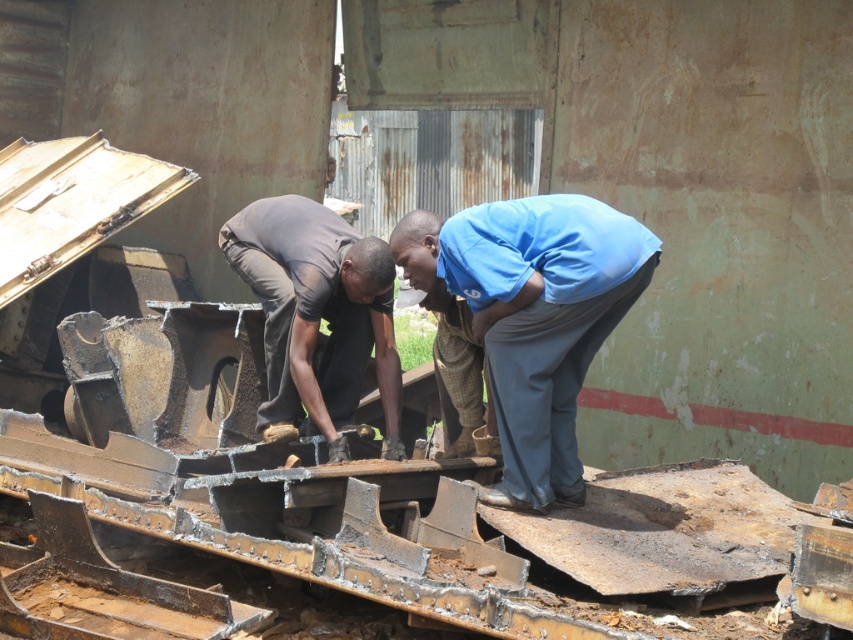
Question: Which object appears farthest from the camera in this image?

Choices:
 (A) dark brown fabric shirt at center
 (B) blue fabric shirt at center

Answer: (A)

Question: Is blue fabric shirt at center below dark brown fabric shirt at center?

Choices:
 (A) no
 (B) yes

Answer: (B)

Question: Which point is farther to the camera?

Choices:
 (A) blue fabric shirt at center
 (B) dark brown fabric shirt at center

Answer: (B)

Question: Does blue fabric shirt at center lie in front of dark brown fabric shirt at center?

Choices:
 (A) yes
 (B) no

Answer: (A)

Question: Does blue fabric shirt at center appear under dark brown fabric shirt at center?

Choices:
 (A) yes
 (B) no

Answer: (A)